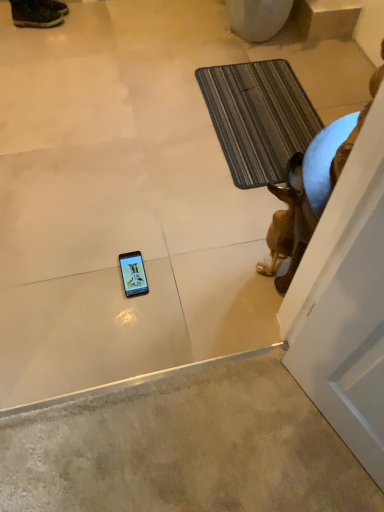
Question: Is leather brown boot at upper left at the right side of brown glossy statue at right?

Choices:
 (A) no
 (B) yes

Answer: (A)

Question: Is brown glossy statue at right a part of leather brown boot at upper left?

Choices:
 (A) yes
 (B) no

Answer: (B)

Question: Considering the relative sizes of leather brown boot at upper left and brown glossy statue at right in the image provided, is leather brown boot at upper left shorter than brown glossy statue at right?

Choices:
 (A) no
 (B) yes

Answer: (B)

Question: Is leather brown boot at upper left positioned before brown glossy statue at right?

Choices:
 (A) yes
 (B) no

Answer: (B)

Question: From a real-world perspective, is leather brown boot at upper left positioned under brown glossy statue at right based on gravity?

Choices:
 (A) no
 (B) yes

Answer: (B)

Question: Can you confirm if leather brown boot at upper left is wider than brown glossy statue at right?

Choices:
 (A) yes
 (B) no

Answer: (B)

Question: Does striped fabric bath mat at upper right have a smaller size compared to brown glossy statue at right?

Choices:
 (A) yes
 (B) no

Answer: (A)

Question: From a real-world perspective, is striped fabric bath mat at upper right located higher than brown glossy statue at right?

Choices:
 (A) no
 (B) yes

Answer: (A)

Question: Can you confirm if striped fabric bath mat at upper right is shorter than brown glossy statue at right?

Choices:
 (A) no
 (B) yes

Answer: (B)

Question: Does striped fabric bath mat at upper right have a greater height compared to brown glossy statue at right?

Choices:
 (A) no
 (B) yes

Answer: (A)

Question: Is brown glossy statue at right a part of striped fabric bath mat at upper right?

Choices:
 (A) no
 (B) yes

Answer: (A)

Question: Is striped fabric bath mat at upper right not within brown glossy statue at right?

Choices:
 (A) yes
 (B) no

Answer: (A)

Question: Is brown glossy statue at right looking in the opposite direction of leather brown boot at upper left?

Choices:
 (A) no
 (B) yes

Answer: (A)